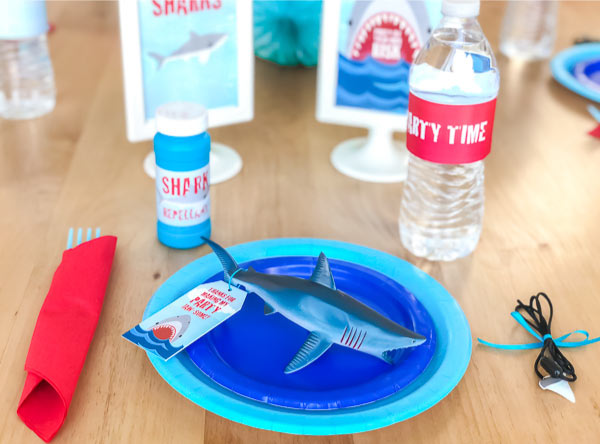
This screenshot has width=600, height=444. In order to click on blue fork wrapped in napkin in this screenshot , I will do `click(81, 235)`, `click(298, 100)`.